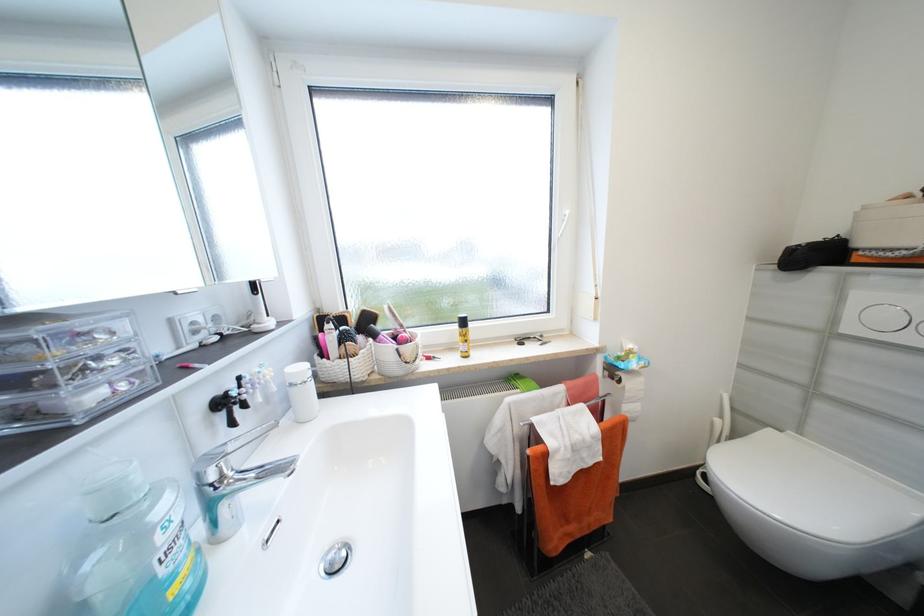
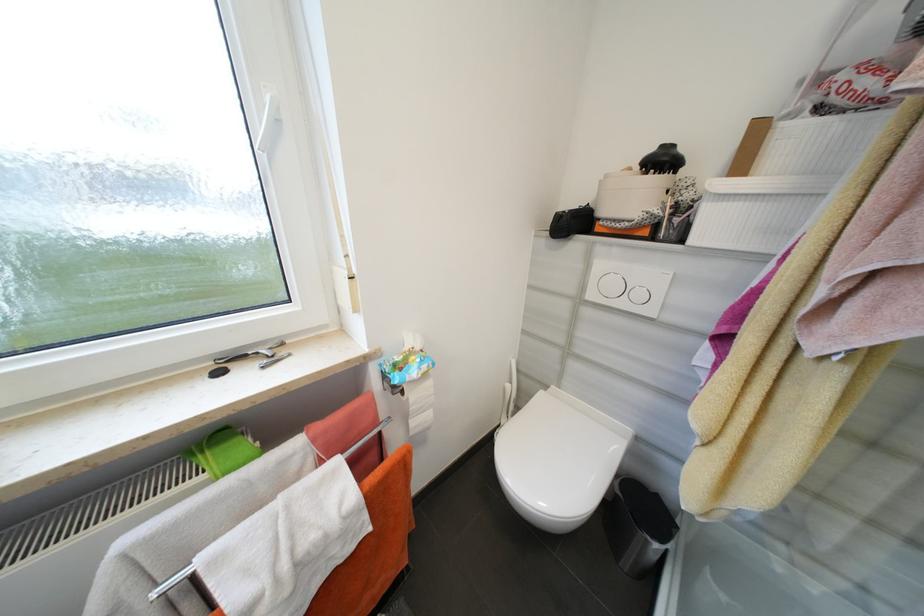
In the second image, find the point that corresponds to (723,421) in the first image.

(514, 387)